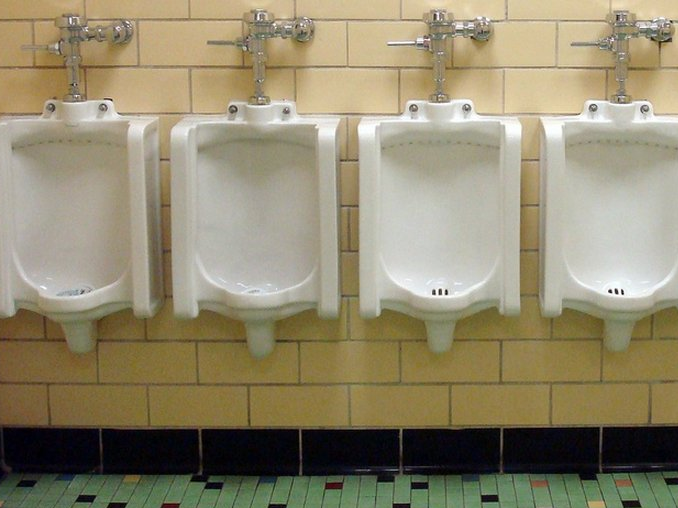
I want to click on handles, so point(26,46), point(220,40), point(403,40), point(590,41).